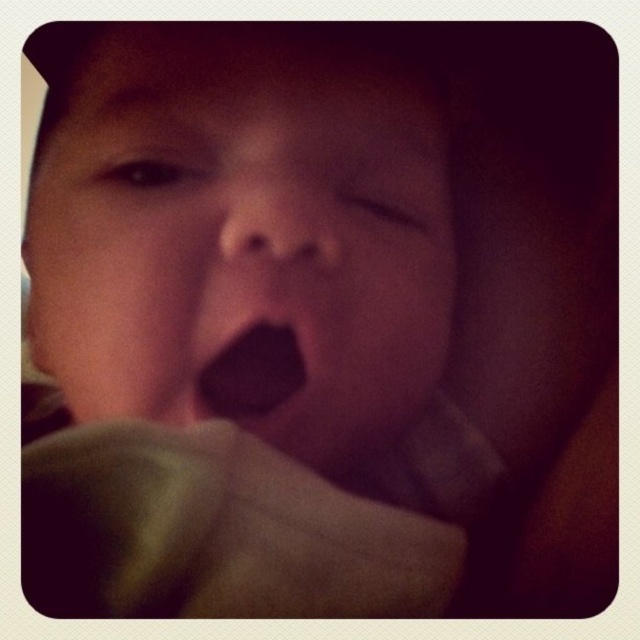
Question: Is smooth skin face at center to the left of black matte tongue at center from the viewer's perspective?

Choices:
 (A) no
 (B) yes

Answer: (B)

Question: From the image, what is the correct spatial relationship of smooth skin face at center in relation to black matte tongue at center?

Choices:
 (A) below
 (B) above

Answer: (B)

Question: Which point is farther from the camera taking this photo?

Choices:
 (A) (225, 348)
 (B) (134, 170)

Answer: (B)

Question: Can you confirm if smooth skin face at center is smaller than black matte tongue at center?

Choices:
 (A) no
 (B) yes

Answer: (A)